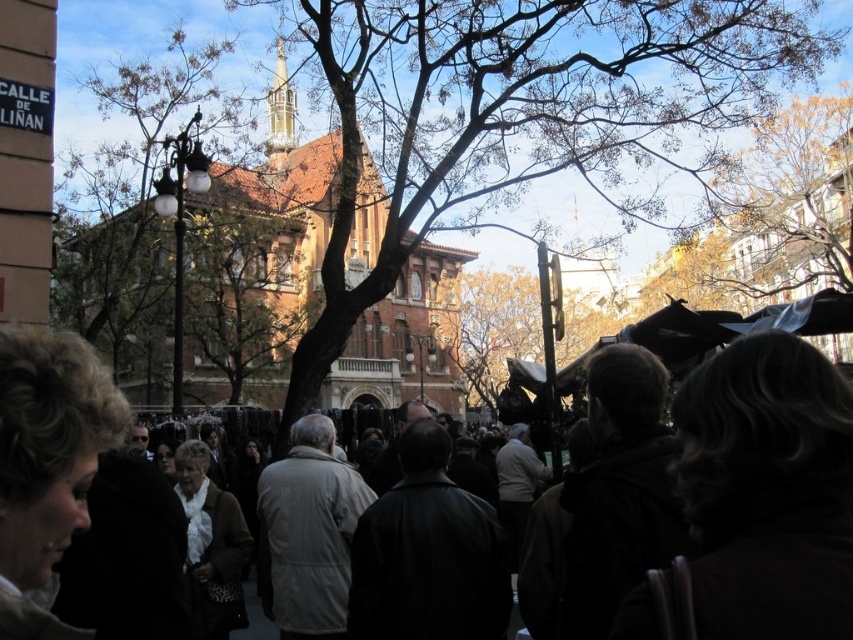
Question: Which point is farther from the camera taking this photo?

Choices:
 (A) (294, 545)
 (B) (308, 310)
 (C) (427, 520)

Answer: (B)

Question: Which object appears closest to the camera in this image?

Choices:
 (A) dark brown leather jacket at center
 (B) beige fabric coat at center

Answer: (A)

Question: Where is brown brick church at center located in relation to beige fabric coat at center in the image?

Choices:
 (A) below
 (B) above

Answer: (B)

Question: Is dark brown leather jacket at center closer to camera compared to beige fabric coat at center?

Choices:
 (A) yes
 (B) no

Answer: (A)

Question: Is bare branches at center to the right of beige fabric coat at center from the viewer's perspective?

Choices:
 (A) yes
 (B) no

Answer: (A)

Question: Among these points, which one is farthest from the camera?

Choices:
 (A) (38, 586)
 (B) (260, 557)
 (C) (486, 157)
 (D) (375, 628)

Answer: (C)